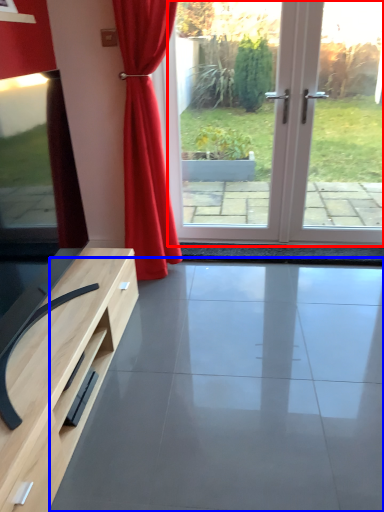
Question: Which point is closer to the camera, screen door (highlighted by a red box) or concrete (highlighted by a blue box)?

Choices:
 (A) screen door
 (B) concrete

Answer: (B)